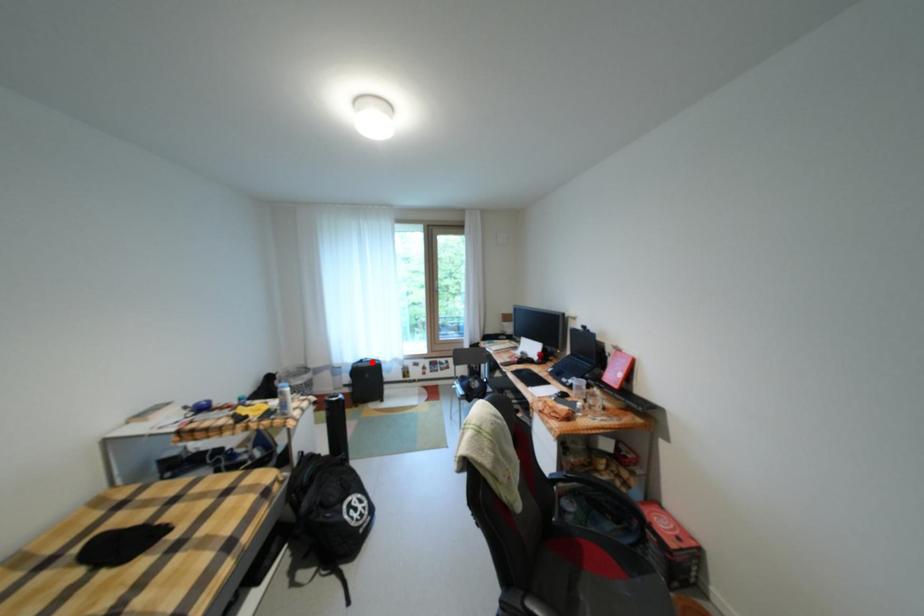
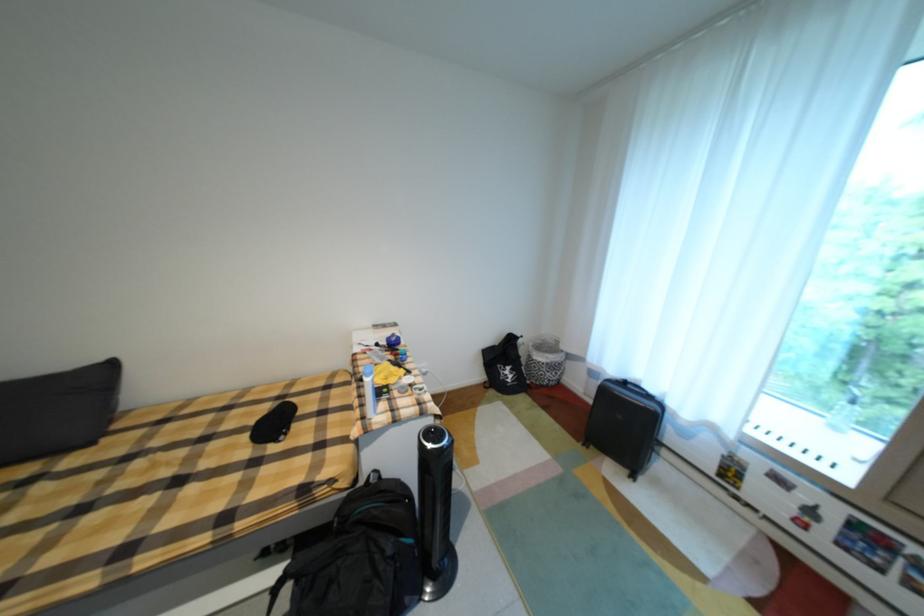
Find the pixel in the second image that matches the highlighted location in the first image.

(635, 384)